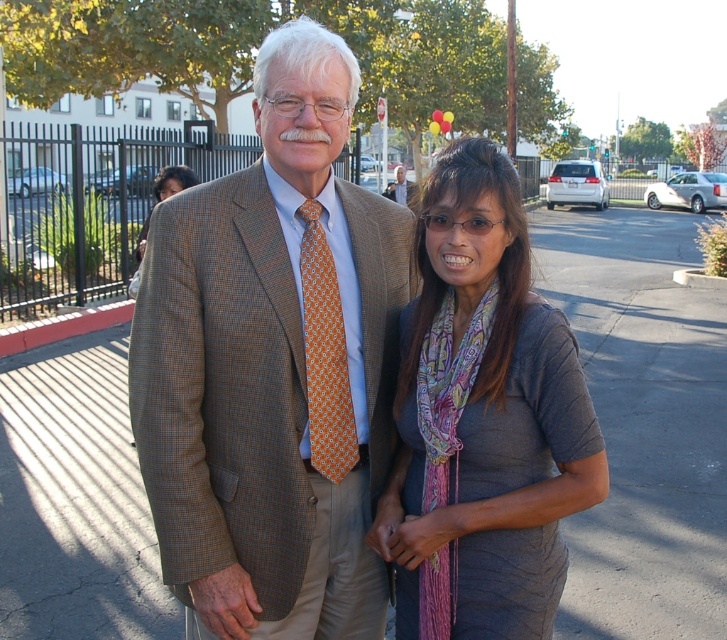
Question: Which object is positioned farthest from the orange printed tie at center?

Choices:
 (A) orange patterned tie at center
 (B) gray fabric dress at center
 (C) gray asphalt pavement at center

Answer: (A)

Question: Which point is closer to the camera?

Choices:
 (A) (449, 582)
 (B) (71, 616)
 (C) (182, 166)
 (D) (345, 385)

Answer: (A)

Question: Which object is farther from the camera taking this photo?

Choices:
 (A) orange printed tie at center
 (B) brown textured suit at center
 (C) matte black hair at upper left

Answer: (C)

Question: Is gray asphalt pavement at center closer to the viewer compared to orange printed tie at center?

Choices:
 (A) yes
 (B) no

Answer: (B)

Question: Does orange printed tie at center lie in front of matte black hair at upper left?

Choices:
 (A) yes
 (B) no

Answer: (A)

Question: Does orange printed tie at center lie behind matte black hair at upper left?

Choices:
 (A) no
 (B) yes

Answer: (A)